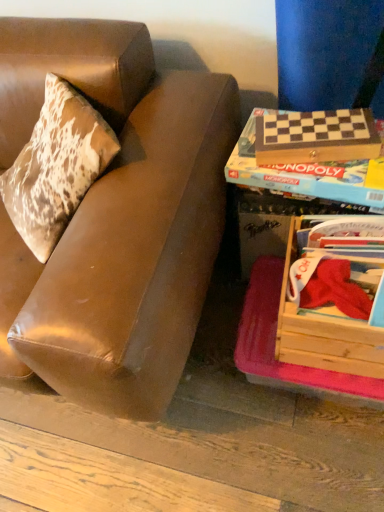
Identify the location of free space in front of wooden checkered board at right, the first paperback book positioned from the top. The height and width of the screenshot is (512, 384). (332, 172).